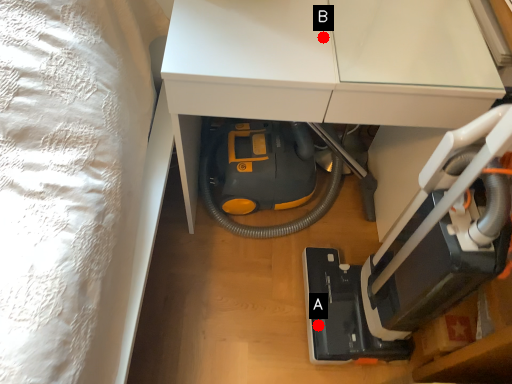
Question: Two points are circled on the image, labeled by A and B beside each circle. Which point is closer to the camera taking this photo?

Choices:
 (A) A is closer
 (B) B is closer

Answer: (B)